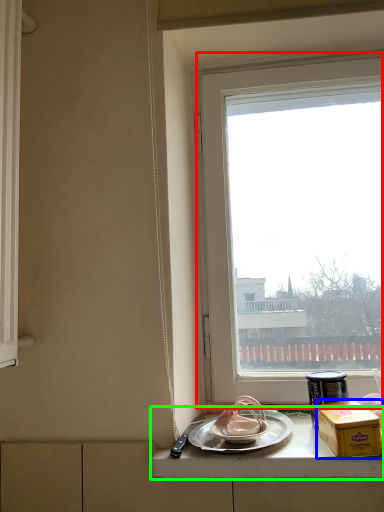
Question: Which is farther away from window (highlighted by a red box)? box (highlighted by a blue box) or counter top (highlighted by a green box)?

Choices:
 (A) box
 (B) counter top

Answer: (A)